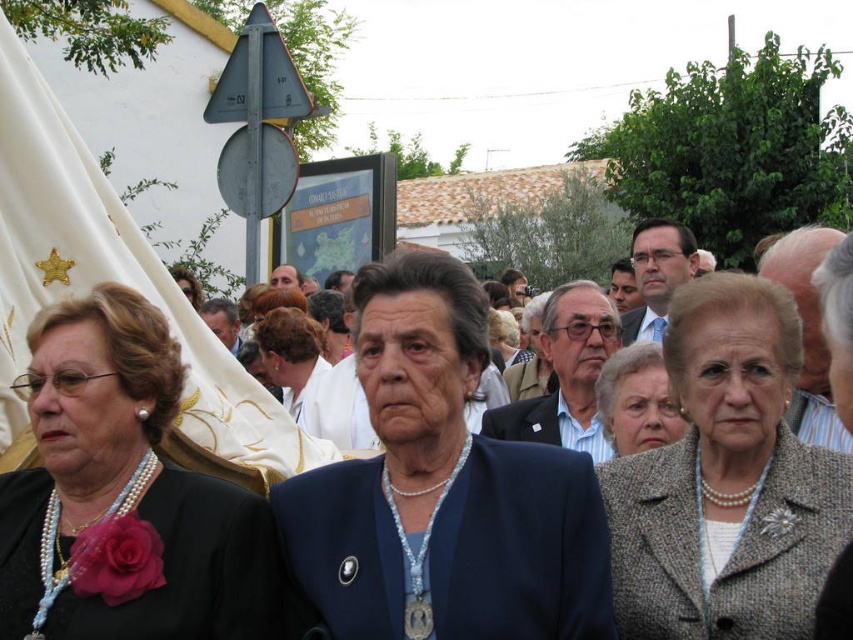
You are a photographer at the event and need to capture a closeup shot of both the pearl necklace at left and the matte gray coat at center. Given that your camera lens has a fixed focal length, which object should you position closer to the camera to ensure both appear the same size in the photo?

The pearl necklace at left is larger in size than the matte gray coat at center. To make them appear the same size in the photo, you should position the smaller matte gray coat at center closer to the camera than the pearl necklace at left.

You are a photographer at the event and need to capture a clear shot of both the pearl necklace at left and the matte gray coat at center. Considering their sizes, which one might require you to adjust your camera focus more to ensure clarity?

The pearl necklace at left is much taller than the matte gray coat at center, so you might need to adjust the camera focus more for the pearl necklace at left to ensure its details are clear.